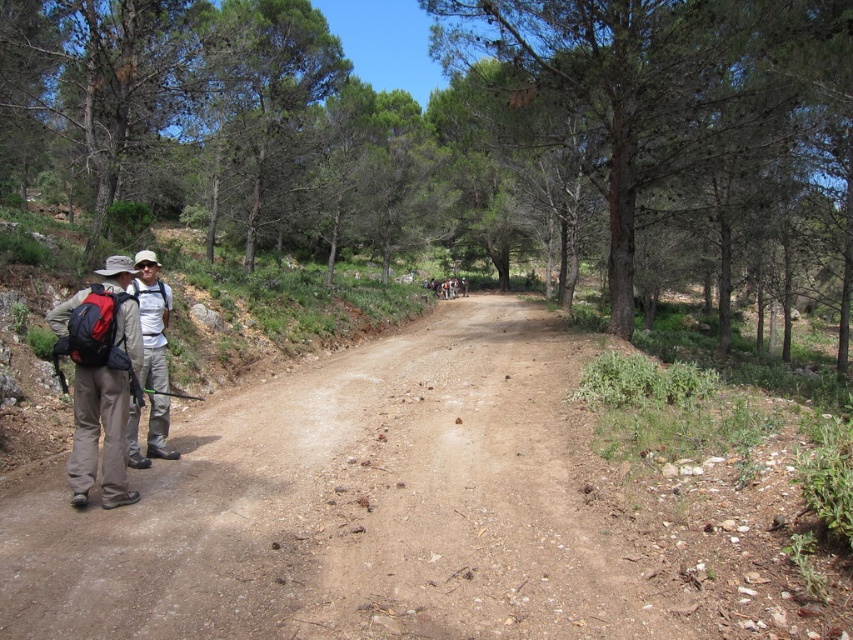
Question: Which point is closer to the camera taking this photo?

Choices:
 (A) (119, 284)
 (B) (144, 372)
 (C) (848, 99)

Answer: (A)

Question: Is green textured tree at center thinner than matte black backpack at left?

Choices:
 (A) yes
 (B) no

Answer: (B)

Question: Can you confirm if green textured tree at center is smaller than matte khaki pants at left?

Choices:
 (A) no
 (B) yes

Answer: (A)

Question: Which of the following is the farthest from the observer?

Choices:
 (A) green textured tree at center
 (B) dirt road at left
 (C) matte khaki pants at left
 (D) matte black backpack at left

Answer: (A)

Question: Which object appears farthest from the camera in this image?

Choices:
 (A) matte black backpack at left
 (B) dirt road at left
 (C) green textured tree at center
 (D) matte khaki pants at left

Answer: (C)

Question: Can you confirm if matte black backpack at left is positioned above matte khaki pants at left?

Choices:
 (A) no
 (B) yes

Answer: (B)